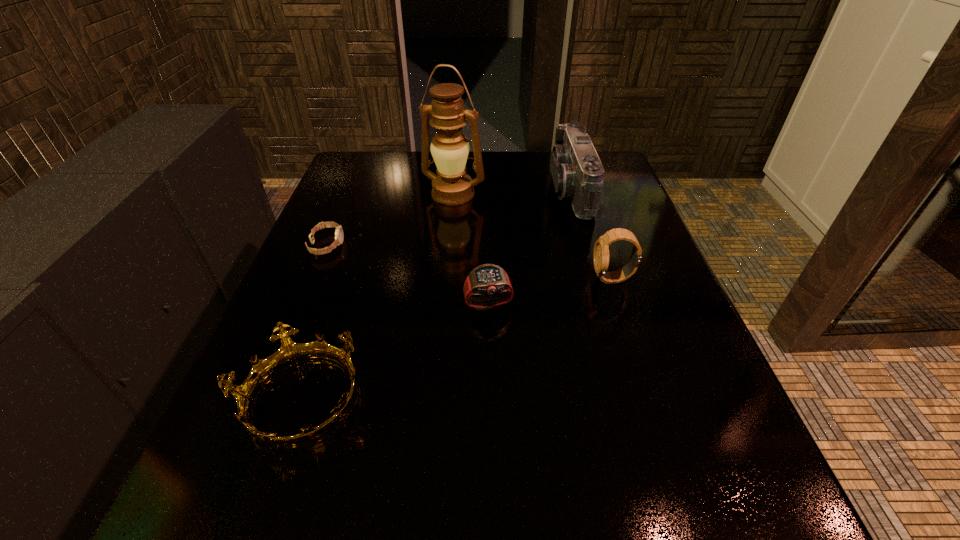
This screenshot has height=540, width=960. Identify the location of free location located 0.190m on the front-facing side of the second tallest object. [475, 190].

The width and height of the screenshot is (960, 540). I want to click on vacant space located on the front-facing side of the second tallest object, so click(404, 190).

Where is `blank space located on the front-facing side of the second tallest object`? blank space located on the front-facing side of the second tallest object is located at coordinates (404, 190).

You are a GUI agent. You are given a task and a screenshot of the screen. Output one action in this format:
    pyautogui.click(x=<x>, y=<y>)
    Task: Click on the blank space located on the face of the fourth farthest object
    The width and height of the screenshot is (960, 540).
    Given the screenshot: What is the action you would take?
    521,279

This screenshot has width=960, height=540. In order to click on vacant space located 0.180m on the face of the fourth farthest object in this screenshot , I will do 501,279.

You are a GUI agent. You are given a task and a screenshot of the screen. Output one action in this format:
    pyautogui.click(x=<x>, y=<y>)
    Task: Click on the blank space located on the face of the fourth farthest object
    
    Given the screenshot: What is the action you would take?
    pyautogui.click(x=537, y=279)

This screenshot has height=540, width=960. I want to click on vacant area situated on the front of the second shortest watch, so click(x=490, y=373).

Find the location of a particular element. This screenshot has height=540, width=960. vacant region located 0.310m on the right of the crown is located at coordinates (565, 399).

Locate an element on the screen. free space located 0.180m on the face of the leftmost watch is located at coordinates (426, 245).

Image resolution: width=960 pixels, height=540 pixels. I want to click on oil lamp located in the far edge section of the desktop, so click(x=451, y=186).